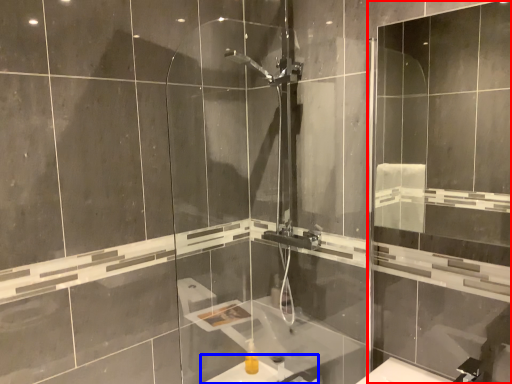
Question: Among these objects, which one is nearest to the camera, screen door (highlighted by a red box) or sink (highlighted by a blue box)?

Choices:
 (A) screen door
 (B) sink

Answer: (A)